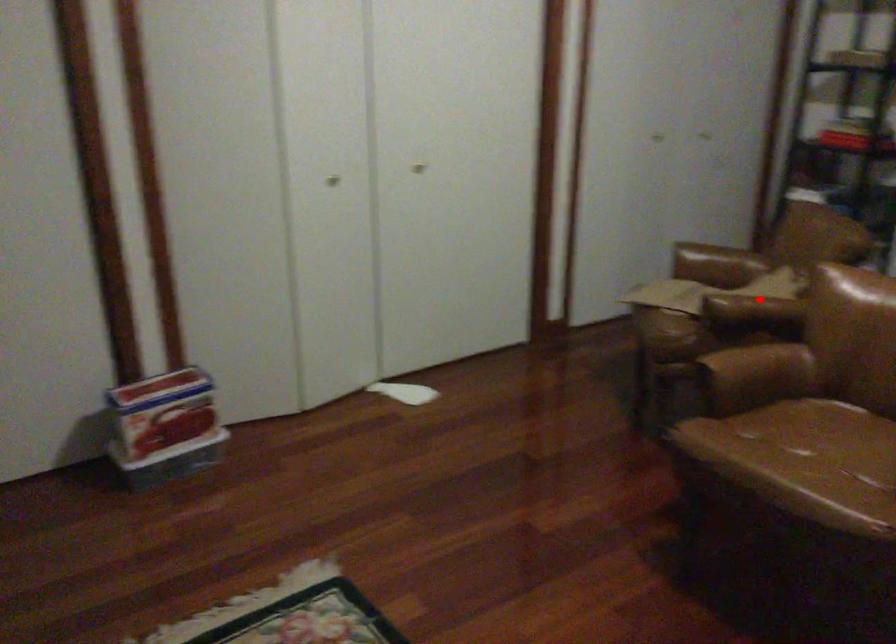
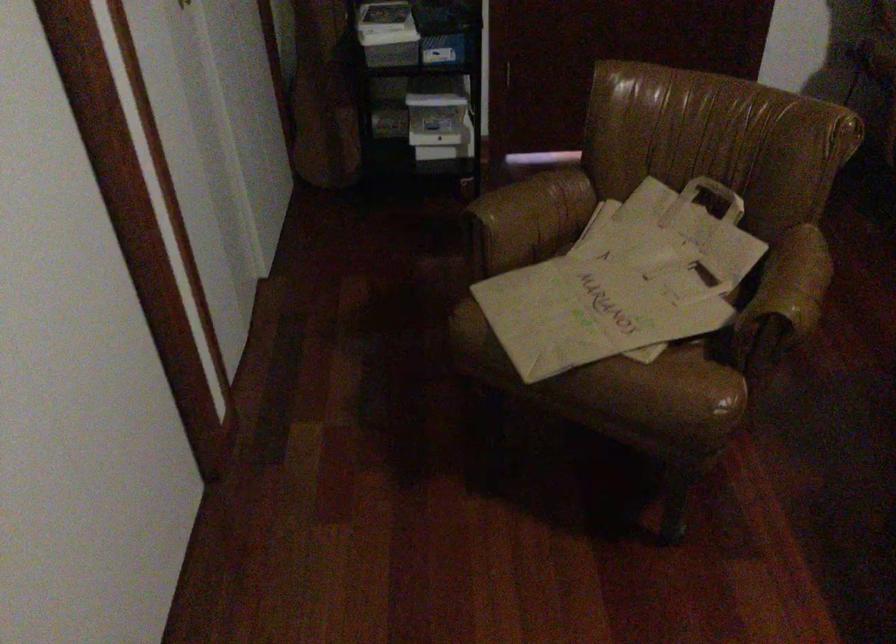
Question: I am providing you with two images of the same scene from different viewpoints. In image1, a red point is highlighted. Considering the same 3D point in image2, which of the following is correct?

Choices:
 (A) It is closer
 (B) It is farther

Answer: (A)